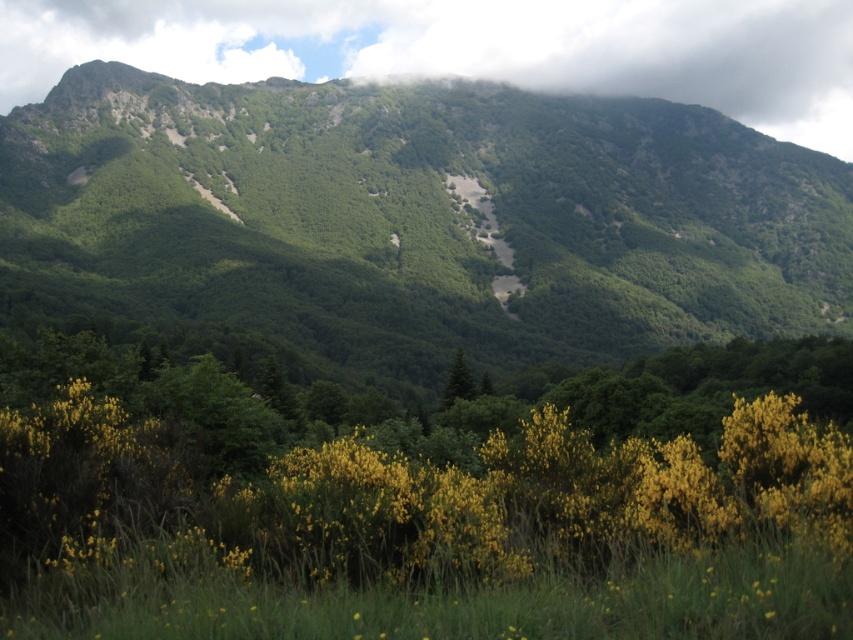
Question: Can you confirm if green leafy mountain at center is wider than white fluffy cloud at upper center?

Choices:
 (A) yes
 (B) no

Answer: (A)

Question: Which is nearer to the green matte tree at center?

Choices:
 (A) white fluffy cloud at upper center
 (B) green leafy mountain at center

Answer: (B)

Question: Does green leafy mountain at center appear on the left side of white fluffy cloud at upper center?

Choices:
 (A) yes
 (B) no

Answer: (A)

Question: Estimate the real-world distances between objects in this image. Which object is closer to the white fluffy cloud at upper center?

Choices:
 (A) green matte tree at center
 (B) green leafy mountain at center

Answer: (B)

Question: Does white fluffy cloud at upper center have a lesser width compared to green matte tree at center?

Choices:
 (A) yes
 (B) no

Answer: (B)

Question: Which point is farther to the camera?

Choices:
 (A) (422, 68)
 (B) (15, 252)
 (C) (462, 358)

Answer: (A)